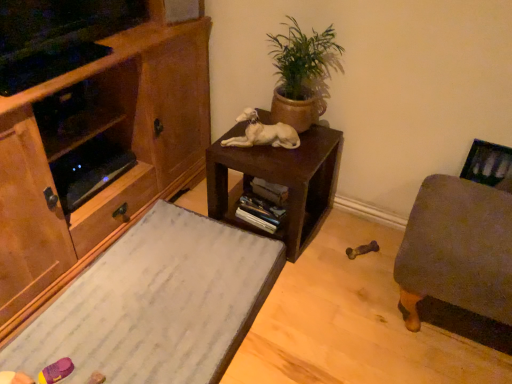
I want to click on vacant space to the right of brown matte table at center, so click(351, 241).